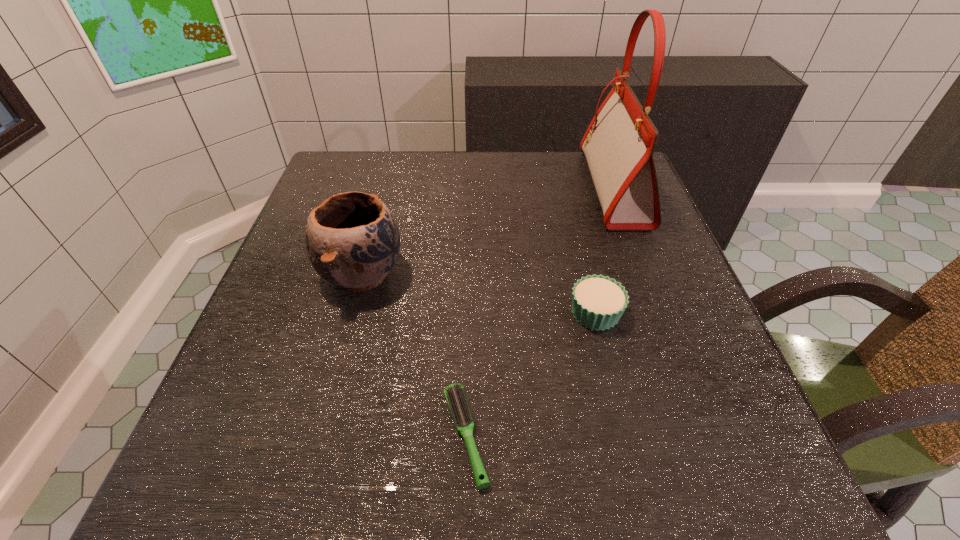
Image resolution: width=960 pixels, height=540 pixels. Find the location of `vacant space at the left edge of the desktop`. vacant space at the left edge of the desktop is located at coordinates click(x=338, y=312).

Locate an element on the screen. This screenshot has height=540, width=960. vacant space at the right edge of the desktop is located at coordinates (702, 389).

The height and width of the screenshot is (540, 960). What are the coordinates of `free region at the far left corner` in the screenshot? It's located at click(x=346, y=152).

Find the location of a particular element. The width and height of the screenshot is (960, 540). vacant area between the cupcake and the leftmost object is located at coordinates (479, 293).

This screenshot has width=960, height=540. What are the coordinates of `empty location between the hairbrush and the leftmost object` in the screenshot? It's located at (414, 355).

Find the location of a particular element. This screenshot has height=540, width=960. unoccupied area between the second object from right to left and the hairbrush is located at coordinates (531, 374).

The height and width of the screenshot is (540, 960). I want to click on vacant area that lies between the hairbrush and the pottery, so click(x=414, y=355).

The height and width of the screenshot is (540, 960). What are the coordinates of `free spot between the farthest object and the hairbrush` in the screenshot? It's located at (540, 312).

Where is `free spot between the pottery and the farthest object`? The image size is (960, 540). free spot between the pottery and the farthest object is located at coordinates (488, 231).

Find the location of a particular element. The height and width of the screenshot is (540, 960). free point between the nearest object and the farthest object is located at coordinates (540, 312).